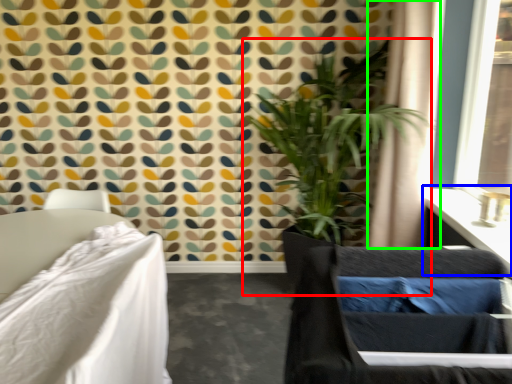
Question: Which object is positioned closest to houseplant (highlighted by a red box)? Select from vanity (highlighted by a blue box) and curtain (highlighted by a green box).

Choices:
 (A) vanity
 (B) curtain

Answer: (B)